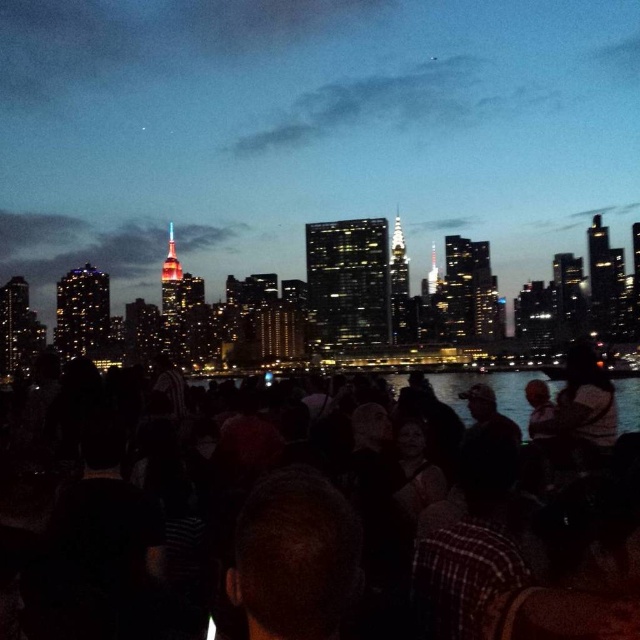
How much distance is there between transparent water at center and black matte crowd at center?

transparent water at center and black matte crowd at center are 4.18 meters apart from each other.

Between transparent water at center and black matte crowd at center, which one is positioned lower?

black matte crowd at center

Between point (621, 417) and point (513, 392), which one is positioned behind?

Positioned behind is point (621, 417).

At what (x,y) coordinates should I click in order to perform the action: click on transparent water at center. Please return your answer as a coordinate pair (x, y). This screenshot has height=640, width=640. Looking at the image, I should click on (493, 390).